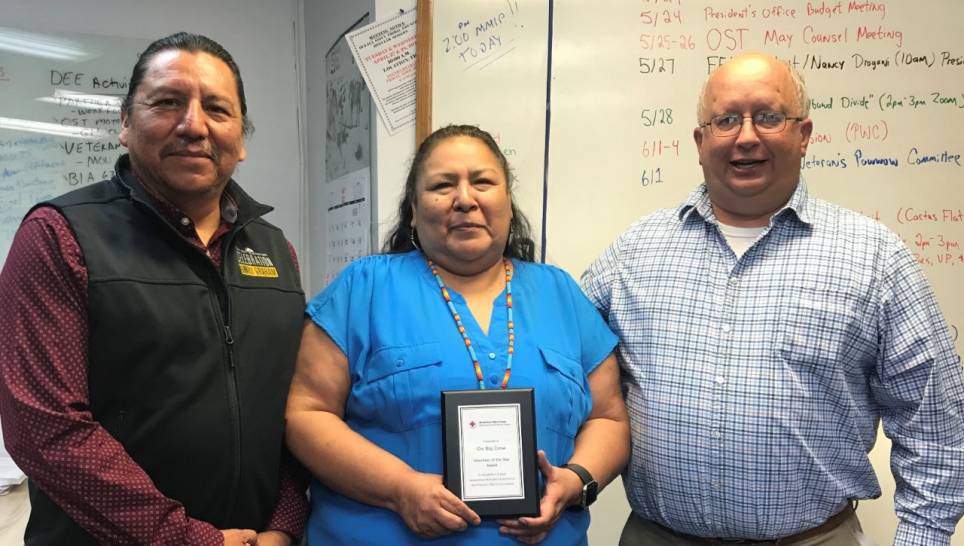
This screenshot has width=964, height=546. In order to click on table top in this screenshot , I will do `click(16, 515)`.